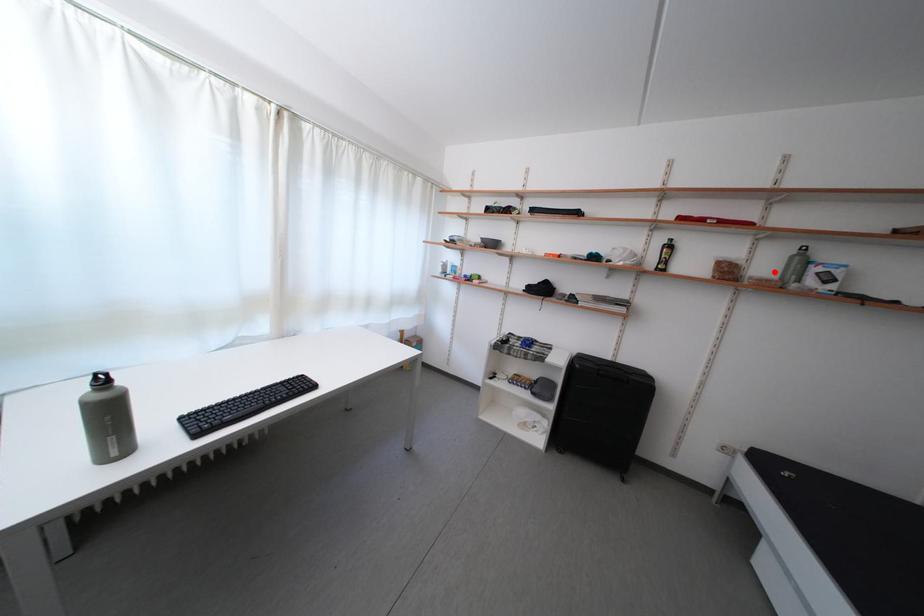
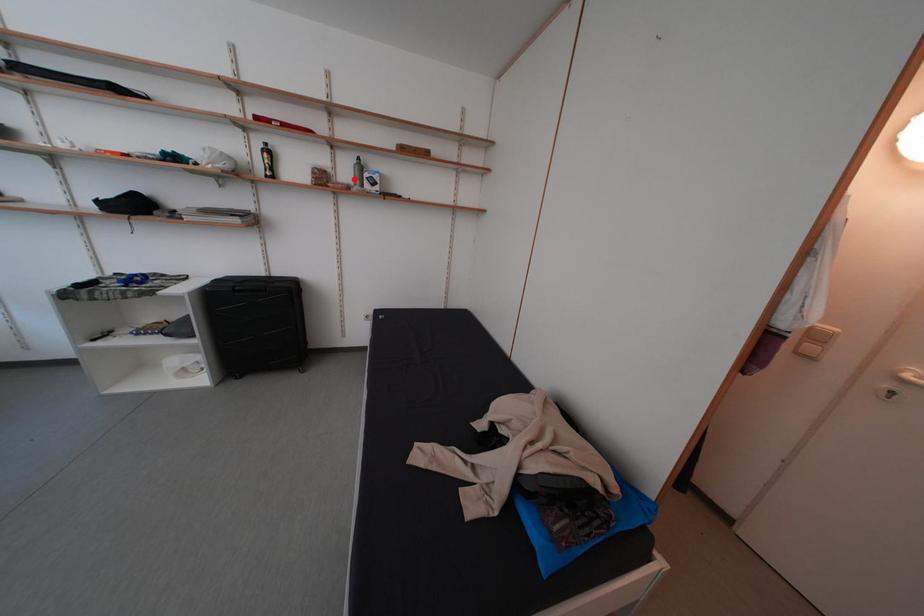
I am providing you with two images of the same scene from different viewpoints. A red point is marked on the first image and another point is marked on the second image. Are the points marked in image1 and image2 representing the same 3D position?

Yes